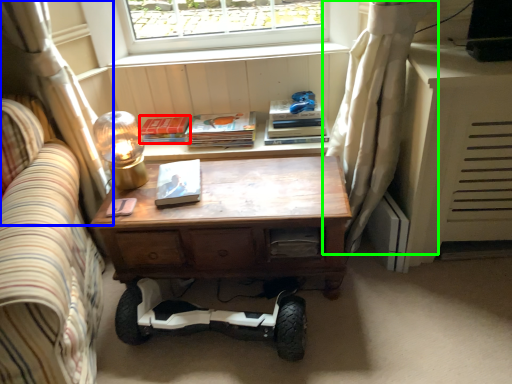
Question: Which is nearer to the paperback book (highlighted by a red box)? curtain (highlighted by a blue box) or curtain (highlighted by a green box).

Choices:
 (A) curtain
 (B) curtain

Answer: (A)